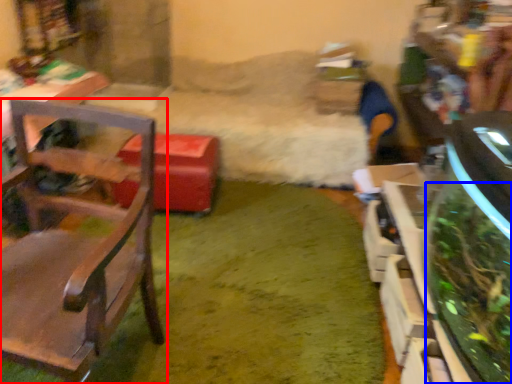
Question: Which object is closer to the camera taking this photo, chair (highlighted by a red box) or plant (highlighted by a blue box)?

Choices:
 (A) chair
 (B) plant

Answer: (A)